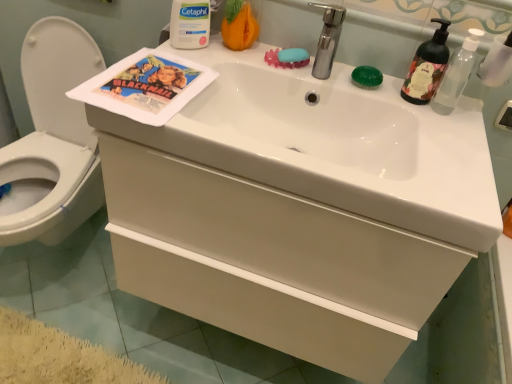
Where is `vacant space that's between green matte soap at upper right, the 1th soap in the right-to-left sequence, and blue matte soap at upper center, which is the second soap from right to left`? The width and height of the screenshot is (512, 384). vacant space that's between green matte soap at upper right, the 1th soap in the right-to-left sequence, and blue matte soap at upper center, which is the second soap from right to left is located at coordinates (327, 73).